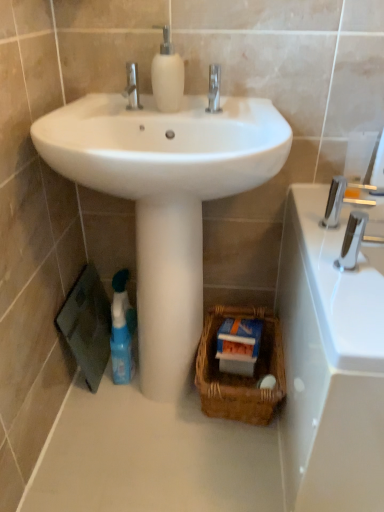
Question: Does brown woven basket at lower center have a greater width compared to silver metallic faucet at upper right?

Choices:
 (A) yes
 (B) no

Answer: (A)

Question: Does brown woven basket at lower center come behind silver metallic faucet at upper right?

Choices:
 (A) yes
 (B) no

Answer: (A)

Question: Is the position of brown woven basket at lower center less distant than that of silver metallic faucet at upper right?

Choices:
 (A) no
 (B) yes

Answer: (A)

Question: Can you confirm if brown woven basket at lower center is smaller than silver metallic faucet at upper right?

Choices:
 (A) yes
 (B) no

Answer: (B)

Question: From the image's perspective, does brown woven basket at lower center appear higher than silver metallic faucet at upper right?

Choices:
 (A) yes
 (B) no

Answer: (B)

Question: Considering their positions, is white glossy sink at center located in front of or behind silver metallic faucet at upper right?

Choices:
 (A) front
 (B) behind

Answer: (A)

Question: From a real-world perspective, is white glossy sink at center physically located above or below silver metallic faucet at upper right?

Choices:
 (A) below
 (B) above

Answer: (B)

Question: From their relative heights in the image, would you say white glossy sink at center is taller or shorter than silver metallic faucet at upper right?

Choices:
 (A) tall
 (B) short

Answer: (A)

Question: From the image's perspective, relative to silver metallic faucet at upper right, is white glossy sink at center above or below?

Choices:
 (A) above
 (B) below

Answer: (A)

Question: Looking at the image, does polished chrome tap at right seem bigger or smaller compared to white glossy sink at center?

Choices:
 (A) big
 (B) small

Answer: (B)

Question: Is polished chrome tap at right situated inside white glossy sink at center or outside?

Choices:
 (A) inside
 (B) outside

Answer: (B)

Question: Considering the relative positions of polished chrome tap at right and white glossy sink at center in the image provided, is polished chrome tap at right to the left or to the right of white glossy sink at center?

Choices:
 (A) right
 (B) left

Answer: (A)

Question: Considering the positions of polished chrome tap at right and white glossy sink at center in the image, is polished chrome tap at right wider or thinner than white glossy sink at center?

Choices:
 (A) wide
 (B) thin

Answer: (B)

Question: Considering the positions of point (334, 218) and point (122, 331), is point (334, 218) closer or farther from the camera than point (122, 331)?

Choices:
 (A) farther
 (B) closer

Answer: (B)

Question: Is silver metallic faucet at upper right inside the boundaries of blue glossy bottle at lower left, or outside?

Choices:
 (A) inside
 (B) outside

Answer: (B)